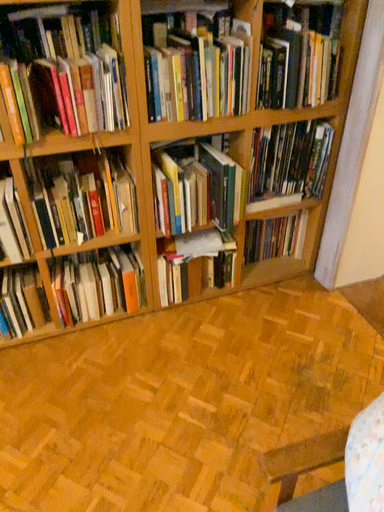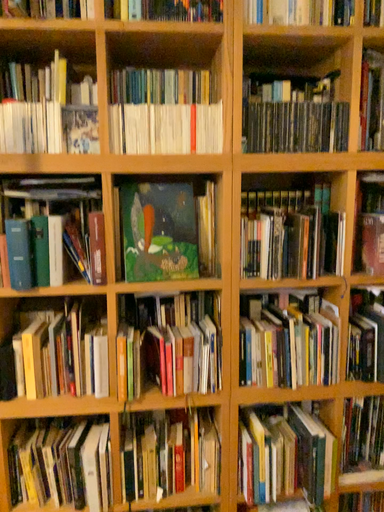
Question: How did the camera likely rotate when shooting the video?

Choices:
 (A) rotated upward
 (B) rotated downward

Answer: (A)